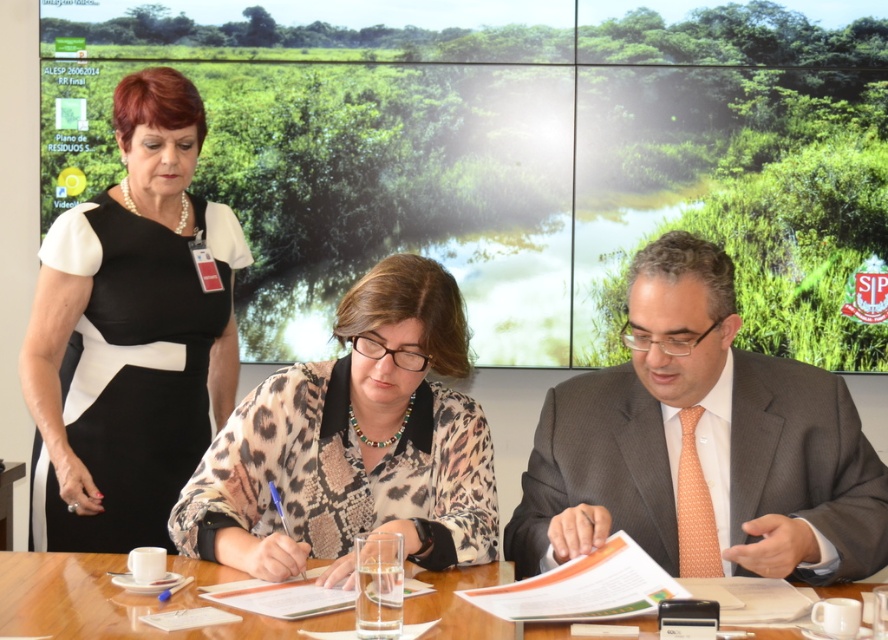
You are attending a formal meeting and need to locate the orange dotted tie at center and the black satin dress at upper left. Which object is closer to the bottom of the image?

The orange dotted tie at center is positioned under the black satin dress at upper left, so it is closer to the bottom of the image.

You are a photographer positioned behind the camera, aiming to capture a clear shot of both the orange dotted tie at center and the black satin dress at upper left. Which object will appear larger in your photo?

The orange dotted tie at center will appear larger in the photo because it is closer to the viewer than the black satin dress at upper left.

You are an assistant at the meeting. The meeting organizer asks you to locate the orange dotted tie at center. Based on the scene description, where would you direct their attention?

The orange dotted tie at center is located at the 2D coordinates point (702, 444) in the image.